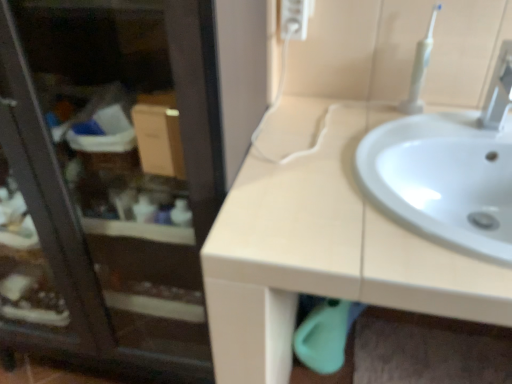
The image size is (512, 384). Find the location of `empty space that is in between white plastic tap at upper right and white plastic toothbrush at upper right`. empty space that is in between white plastic tap at upper right and white plastic toothbrush at upper right is located at coordinates (453, 125).